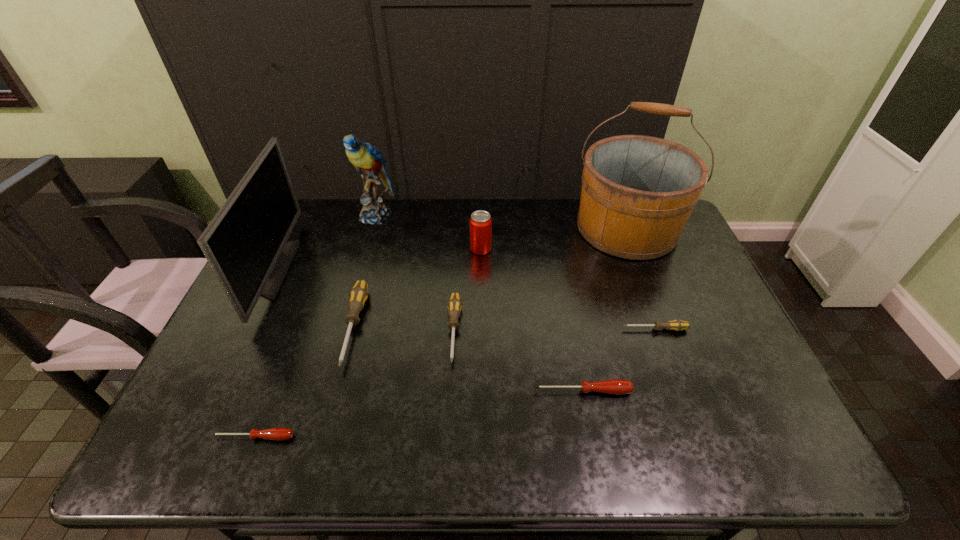
At what (x,y) coordinates should I click in order to perform the action: click on object that is at the near edge. Please return your answer as a coordinate pair (x, y). Image resolution: width=960 pixels, height=540 pixels. Looking at the image, I should click on (278, 434).

The width and height of the screenshot is (960, 540). In order to click on monitor at the left edge in this screenshot , I will do `click(245, 244)`.

You are a GUI agent. You are given a task and a screenshot of the screen. Output one action in this format:
    pyautogui.click(x=<x>, y=<y>)
    Task: Click on the screwdriver that is at the left edge
    The height and width of the screenshot is (540, 960).
    Given the screenshot: What is the action you would take?
    pyautogui.click(x=278, y=434)

The image size is (960, 540). Find the location of `bucket at the right edge`. bucket at the right edge is located at coordinates click(x=638, y=192).

You are a GUI agent. You are given a task and a screenshot of the screen. Output one action in this format:
    pyautogui.click(x=<x>, y=<y>)
    Task: Click on the screwdriver situated at the right edge
    
    Given the screenshot: What is the action you would take?
    pyautogui.click(x=677, y=325)

At what (x,y) coordinates should I click in order to perform the action: click on object that is at the far left corner. Please return your answer as a coordinate pair (x, y). The height and width of the screenshot is (540, 960). Looking at the image, I should click on (245, 244).

Find the location of a particular element. The image size is (960, 540). object present at the near left corner is located at coordinates (278, 434).

At what (x,y) coordinates should I click in order to perform the action: click on object at the far right corner. Please return your answer as a coordinate pair (x, y). This screenshot has height=540, width=960. Looking at the image, I should click on (638, 192).

Where is `free spot at the far edge of the desktop`? This screenshot has height=540, width=960. free spot at the far edge of the desktop is located at coordinates (379, 234).

Identify the location of vacant space at the near edge. (399, 461).